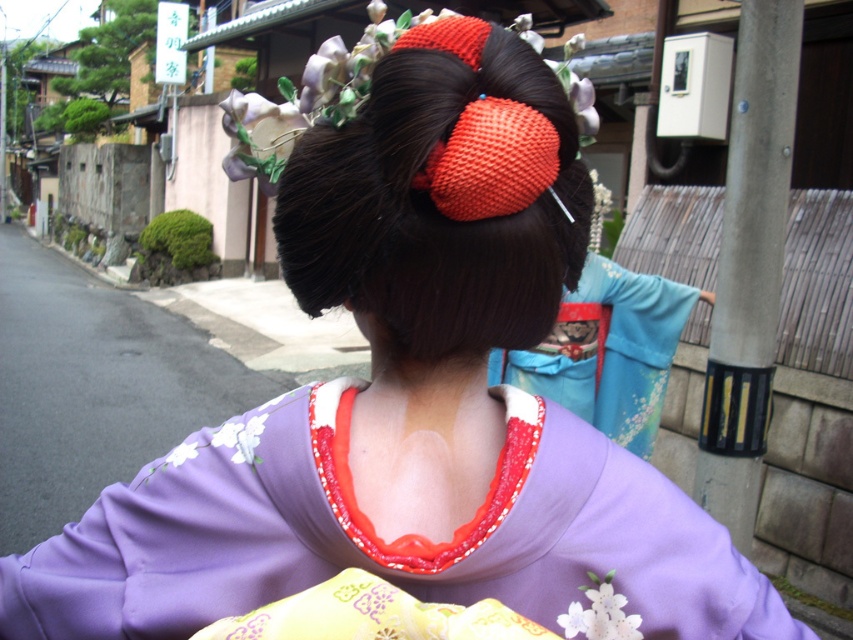
Question: Which point appears farthest from the camera in this image?

Choices:
 (A) (427, 294)
 (B) (28, 557)

Answer: (B)

Question: From the image, what is the correct spatial relationship of purple satin kimono at center in relation to smooth dark brown hair bun at center?

Choices:
 (A) left
 (B) right

Answer: (A)

Question: Where is purple satin kimono at center located in relation to smooth dark brown hair bun at center in the image?

Choices:
 (A) right
 (B) left

Answer: (B)

Question: Considering the relative positions of purple satin kimono at center and smooth dark brown hair bun at center in the image provided, where is purple satin kimono at center located with respect to smooth dark brown hair bun at center?

Choices:
 (A) above
 (B) below

Answer: (B)

Question: Which object is farther from the camera taking this photo?

Choices:
 (A) smooth dark brown hair bun at center
 (B) purple satin kimono at center

Answer: (B)